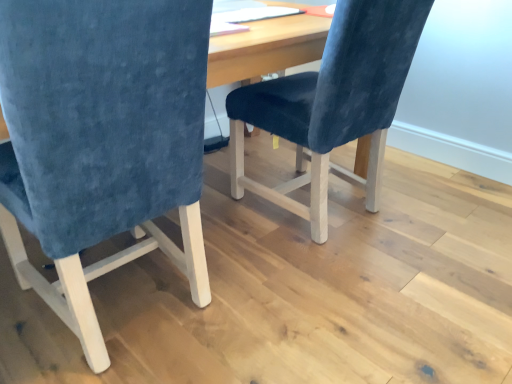
The image size is (512, 384). I want to click on vacant space that is in between velvet blue chair at center, which ranks as the first chair in right-to-left order, and velvet blue chair at left, which is the 1th chair in left-to-right order, so click(x=264, y=263).